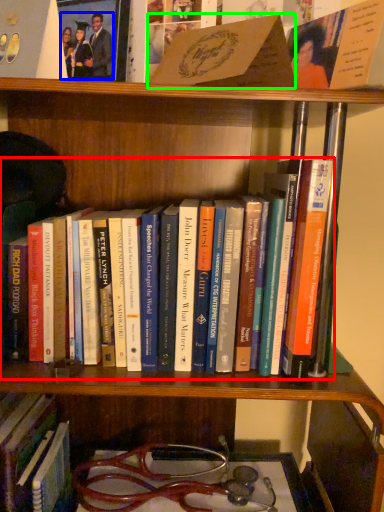
Question: Which object is positioned farthest from book (highlighted by a red box)? Select from couple (highlighted by a blue box) and book (highlighted by a green box).

Choices:
 (A) couple
 (B) book

Answer: (A)